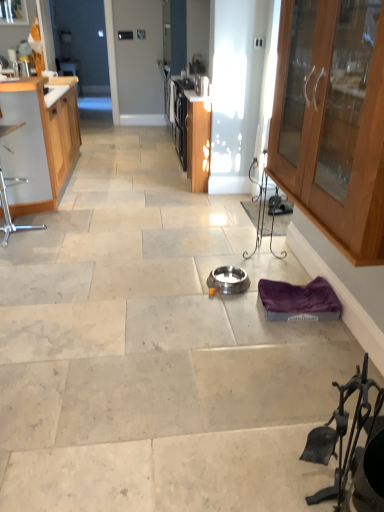
Locate an element on the screen. Image resolution: width=384 pixels, height=512 pixels. vacant area that lies between black wrought iron fireplace tools at lower right, which is counted as the second chair, starting from the top, and metallic silver chair at left, positioned as the 2th chair in right-to-left order is located at coordinates (115, 316).